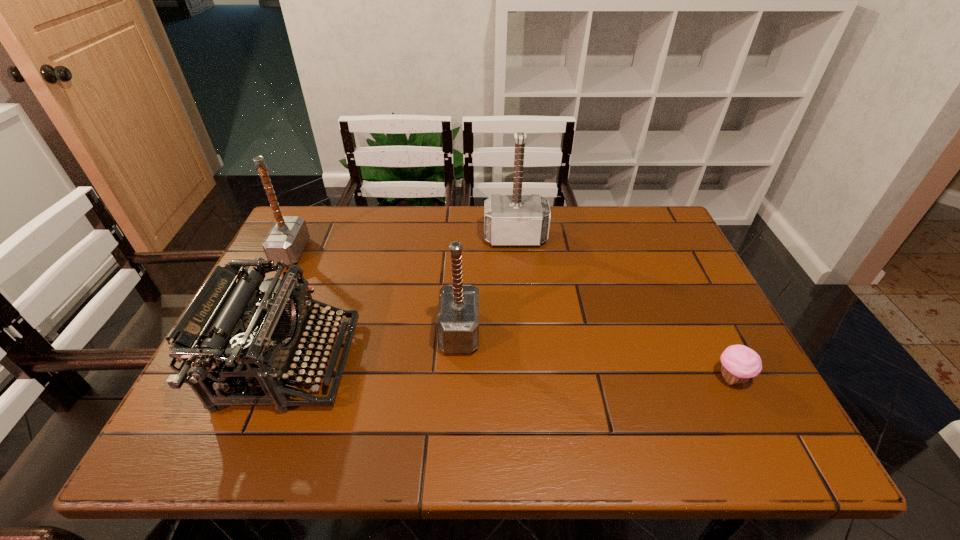
Locate an element on the screen. This screenshot has width=960, height=540. the rightmost hammer is located at coordinates (509, 220).

In order to click on the leftmost hammer in this screenshot , I will do `click(287, 238)`.

Find the location of a particular element. the nearest hammer is located at coordinates (457, 324).

The height and width of the screenshot is (540, 960). I want to click on the second hammer from right to left, so click(x=457, y=324).

Find the location of a particular element. the fourth tallest object is located at coordinates (236, 337).

This screenshot has height=540, width=960. I want to click on cupcake, so click(x=739, y=363).

You are a GUI agent. You are given a task and a screenshot of the screen. Output one action in this format:
    pyautogui.click(x=<x>, y=<y>)
    Task: Click on the shortest object
    Image resolution: width=960 pixels, height=540 pixels.
    Given the screenshot: What is the action you would take?
    pyautogui.click(x=739, y=363)

Identify the location of free location located for striking with the head of the second object from right to left. (522, 315).

Locate an element on the screen. free spot located on the striking surface of the leftmost hammer is located at coordinates (385, 252).

Identify the location of vacant space situated 0.210m on the front of the nearest hammer. (454, 446).